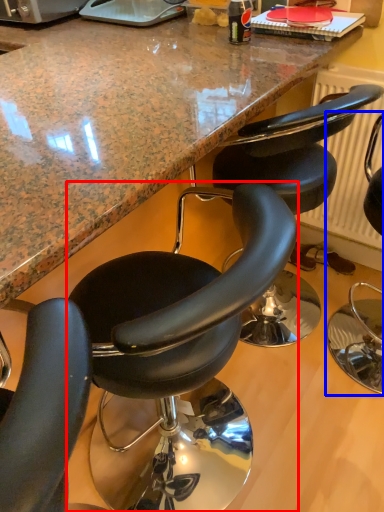
Question: Which object is further to the camera taking this photo, chair (highlighted by a red box) or chair (highlighted by a blue box)?

Choices:
 (A) chair
 (B) chair

Answer: (B)